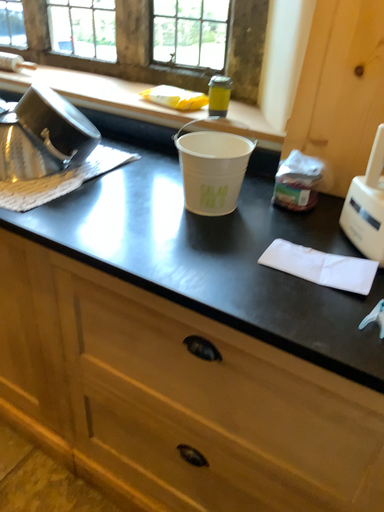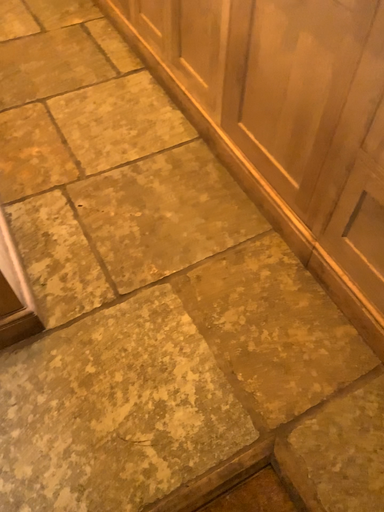
Question: How did the camera likely rotate when shooting the video?

Choices:
 (A) rotated right
 (B) rotated left

Answer: (B)